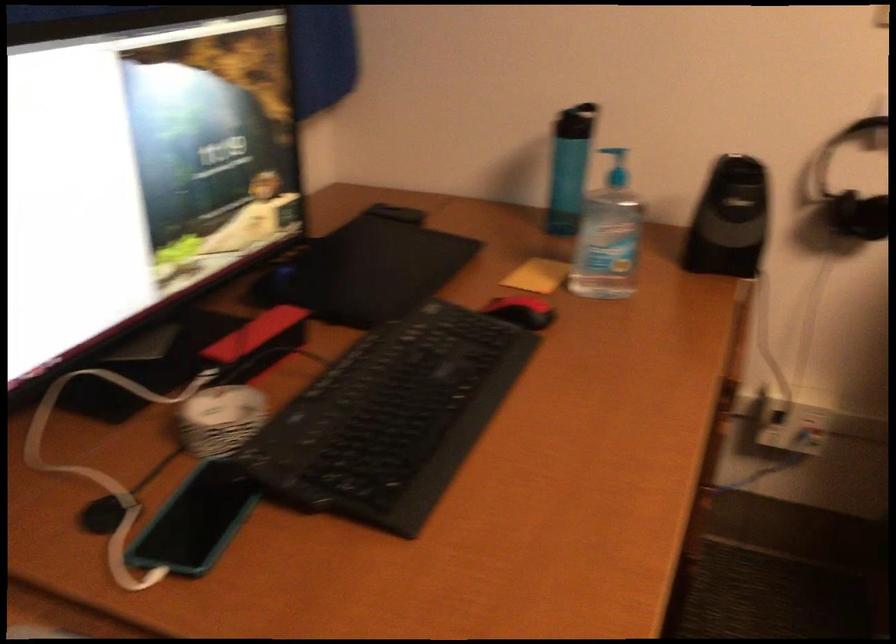
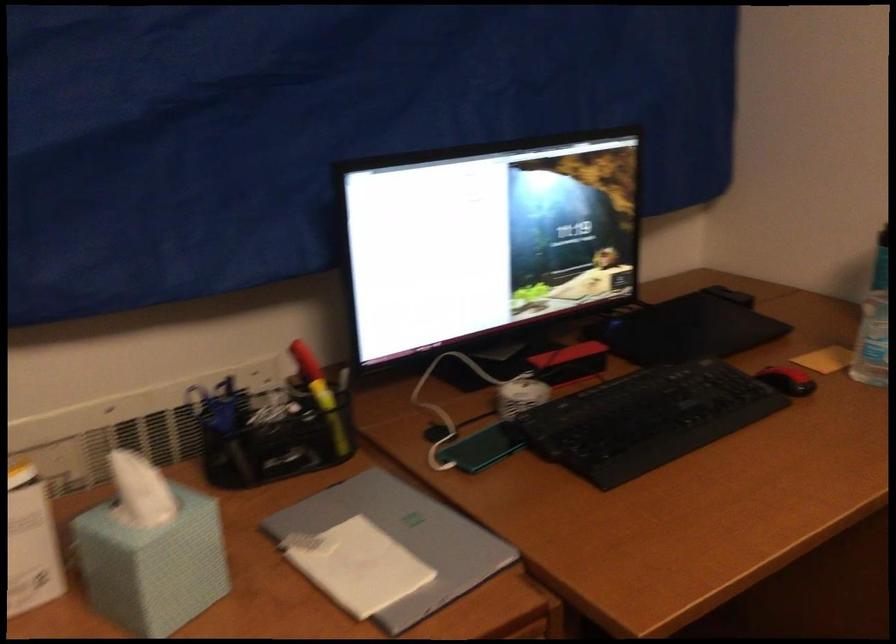
The point at (530, 310) is marked in the first image. Where is the corresponding point in the second image?

(787, 380)